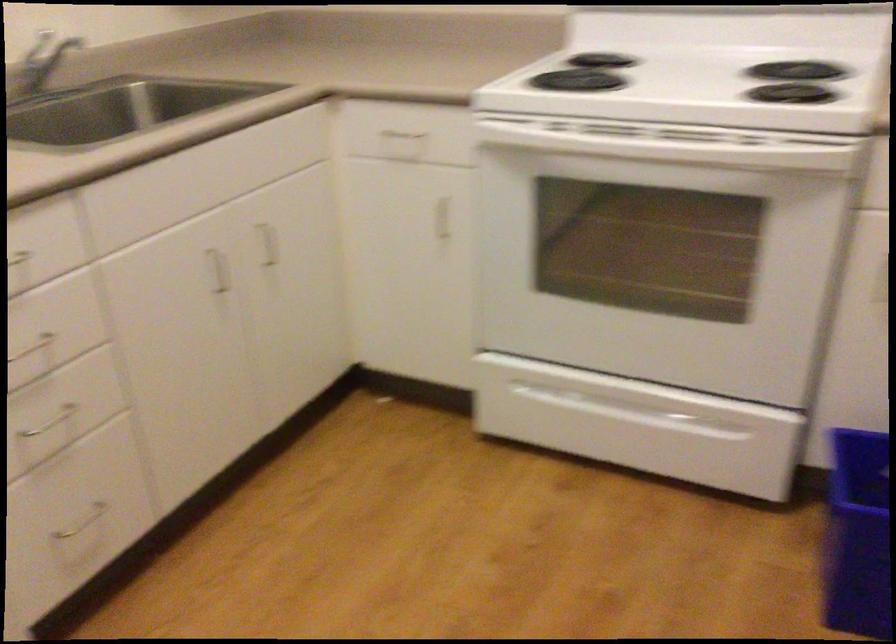
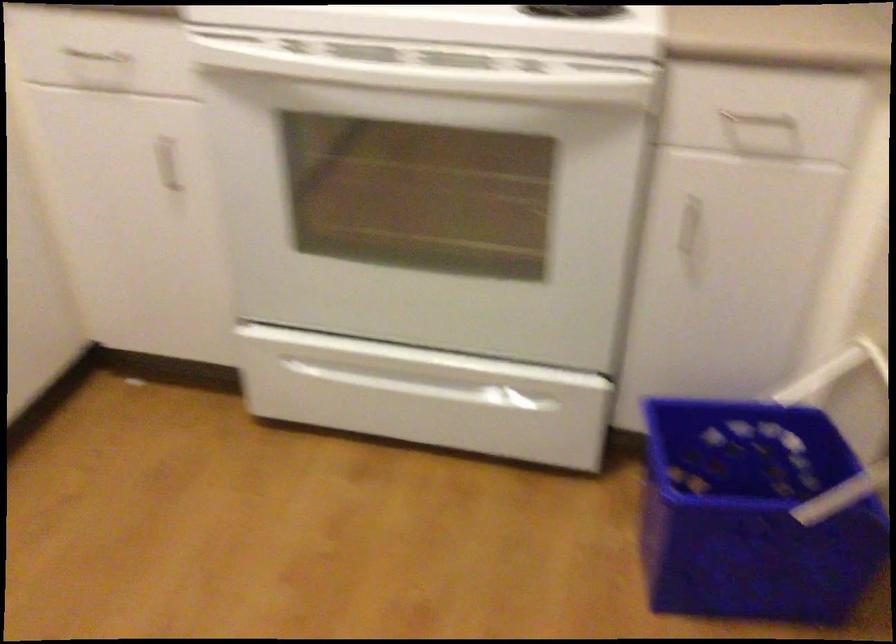
Locate, in the second image, the point that corresponds to point 394,128 in the first image.

(97, 57)